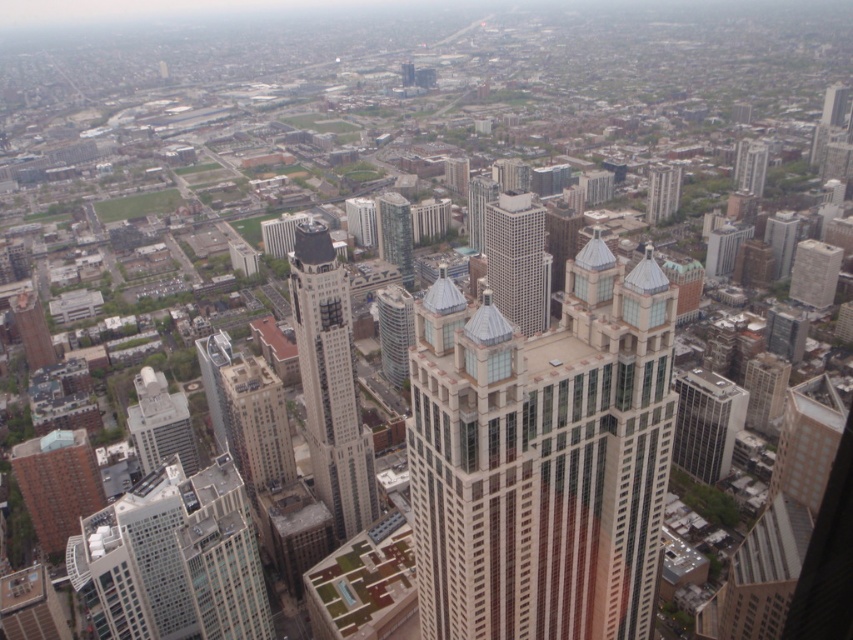
Question: Estimate the real-world distances between objects in this image. Which object is closer to the glassy reflective tower at center?

Choices:
 (A) glassy steel skyscraper at center
 (B) glassy brown building at upper center
 (C) matte gray building at lower left
 (D) glassy tan skyscraper at center

Answer: (A)

Question: Which point is closer to the camera?

Choices:
 (A) glassy tan skyscraper at center
 (B) white glass building at upper right

Answer: (A)

Question: Considering the relative positions of white glass building at lower left and glassy brown building at upper center in the image provided, where is white glass building at lower left located with respect to glassy brown building at upper center?

Choices:
 (A) left
 (B) right

Answer: (A)

Question: Is glassy steel skyscraper at center below glassy reflective skyscraper at center?

Choices:
 (A) no
 (B) yes

Answer: (B)

Question: Can you confirm if glassy steel skyscraper at center is wider than matte gray building at lower left?

Choices:
 (A) no
 (B) yes

Answer: (A)

Question: Which of the following is the farthest from the observer?

Choices:
 (A) (396, 216)
 (B) (741, 166)

Answer: (B)